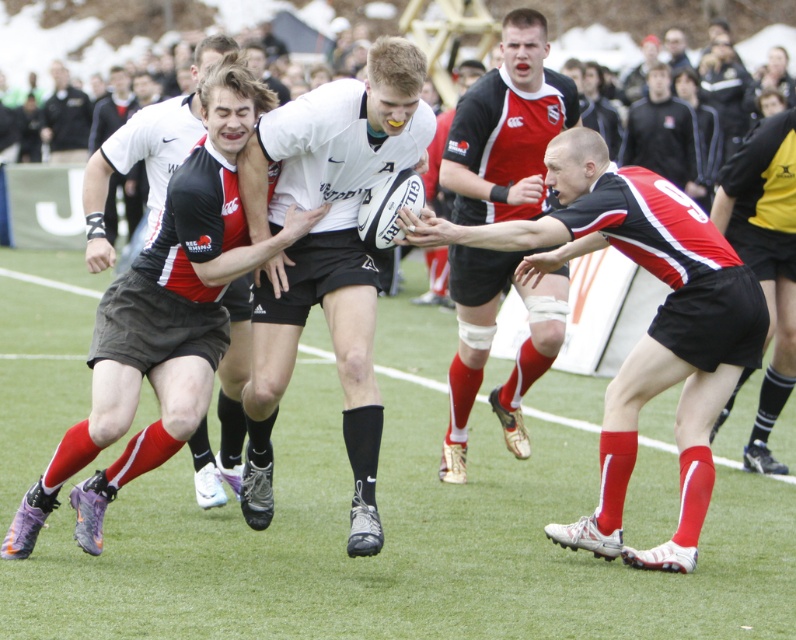
Question: Which object is closer to the camera taking this photo?

Choices:
 (A) dark gray uniform at upper left
 (B) red and black jersey at center
 (C) black jersey at center

Answer: (B)

Question: Can you confirm if black matte shorts at right is positioned to the right of black jersey at center?

Choices:
 (A) no
 (B) yes

Answer: (A)

Question: Does black jersey at center come in front of dark gray uniform at upper left?

Choices:
 (A) no
 (B) yes

Answer: (B)

Question: Estimate the real-world distances between objects in this image. Which object is closer to the green artificial turf at center?

Choices:
 (A) matte black shorts at center
 (B) black matte shorts at right
 (C) red and black jersey at center
 (D) black jersey at center

Answer: (C)

Question: Which point is farther from the camera taking this photo?

Choices:
 (A) (65, 113)
 (B) (207, 266)
 (C) (715, 518)
 (D) (570, 118)

Answer: (A)

Question: Is white matte rugby ball at center above black jersey at center?

Choices:
 (A) yes
 (B) no

Answer: (B)